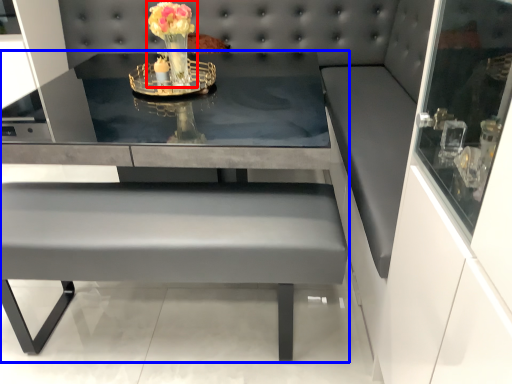
Question: Which point is further to the camera, floral arrangement (highlighted by a red box) or table (highlighted by a blue box)?

Choices:
 (A) floral arrangement
 (B) table

Answer: (A)